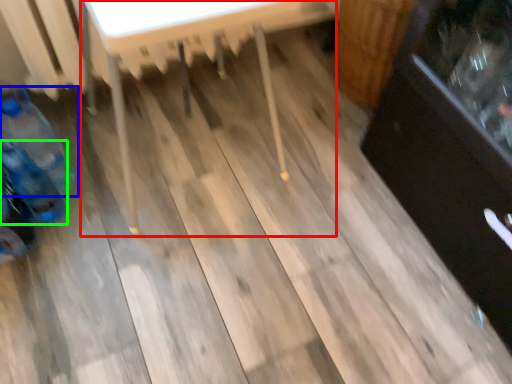
Question: Which is farther away from table (highlighted by a red box)? bottle (highlighted by a blue box) or bottle (highlighted by a green box)?

Choices:
 (A) bottle
 (B) bottle

Answer: (B)